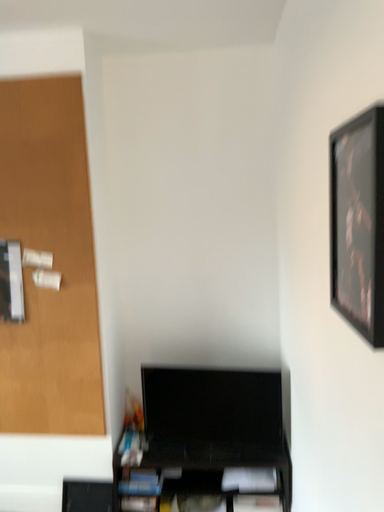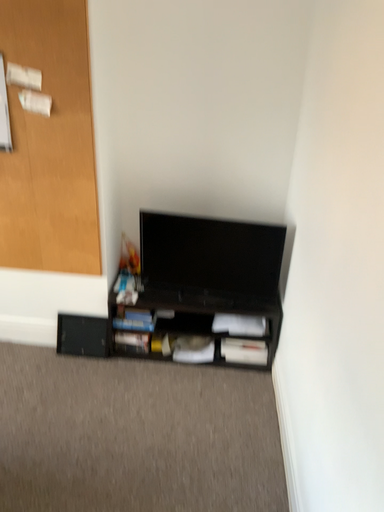
Question: Which way did the camera rotate in the video?

Choices:
 (A) rotated downward
 (B) rotated upward

Answer: (A)